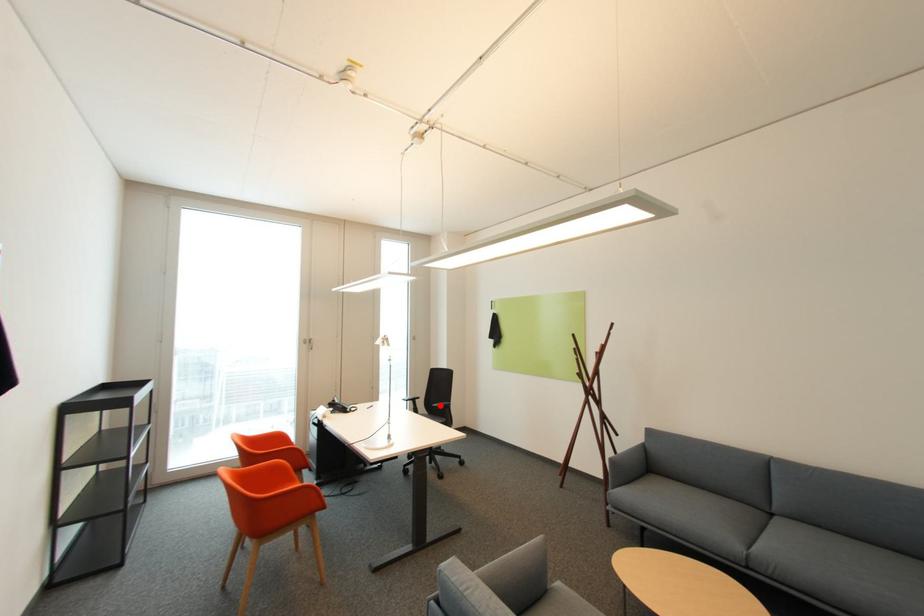
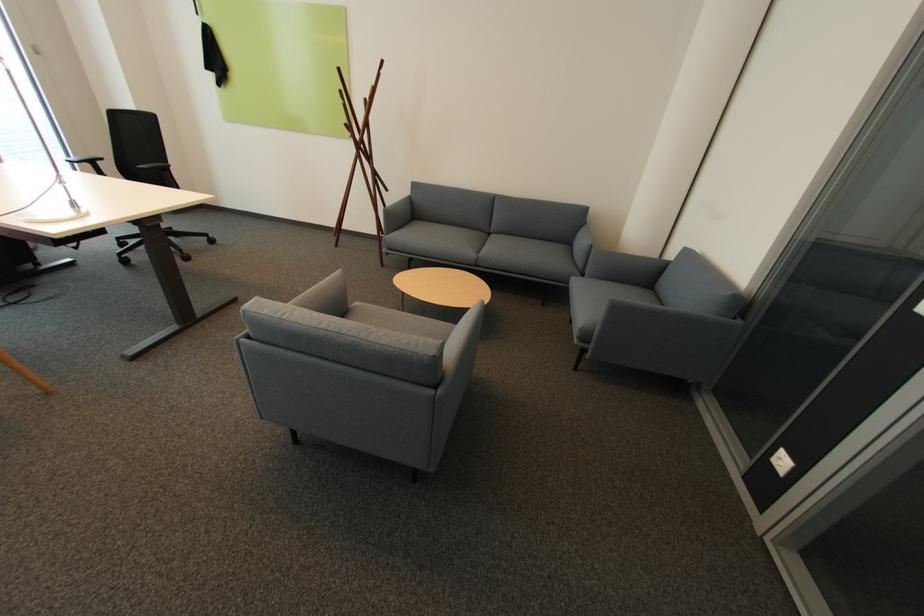
Where in the second image is the point corresponding to the highlighted location from the first image?

(146, 167)